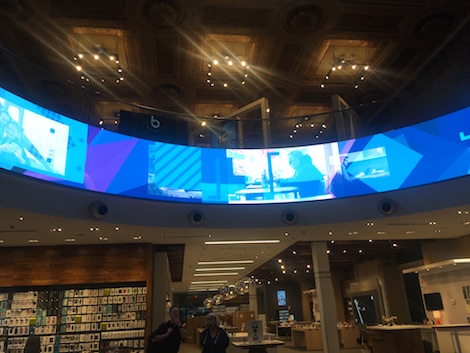
At what (x,y) coordinates should I click in order to perform the action: click on small light fixtures. Please return your answer as a coordinate pair (x, y). Looking at the image, I should click on (225, 65), (112, 56), (325, 75), (255, 277), (284, 269).